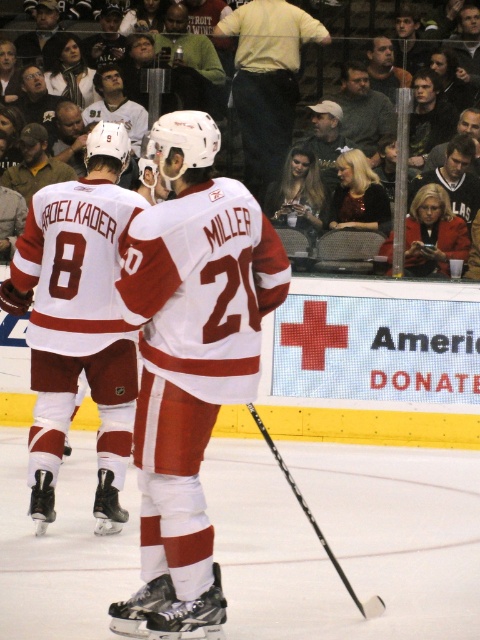
Question: Which object is positioned closest to the white jersey at center?

Choices:
 (A) white matte jersey at center
 (B) black matte hockey stick at center

Answer: (B)

Question: Can you confirm if white matte jersey at center is positioned to the left of black matte hockey stick at center?

Choices:
 (A) yes
 (B) no

Answer: (A)

Question: Which of these objects is positioned closest to the white matte jersey at center?

Choices:
 (A) black matte hockey stick at center
 (B) white jersey at center

Answer: (B)

Question: Does white jersey at center appear on the left side of white matte jersey at center?

Choices:
 (A) yes
 (B) no

Answer: (B)

Question: Where is white matte jersey at center located in relation to black matte hockey stick at center in the image?

Choices:
 (A) above
 (B) below

Answer: (A)

Question: Among these objects, which one is nearest to the camera?

Choices:
 (A) black matte hockey stick at center
 (B) white jersey at center
 (C) white matte jersey at center

Answer: (B)